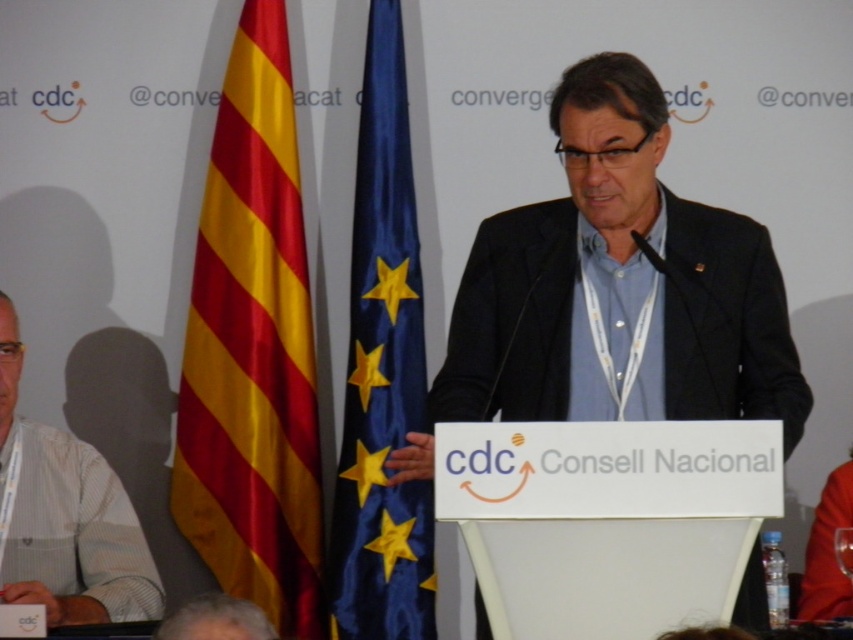
Question: Among these objects, which one is farthest from the camera?

Choices:
 (A) yellow/red striped fabric at left
 (B) blue satin flag at center

Answer: (A)

Question: Is black matte suit at center above yellow/red striped fabric at left?

Choices:
 (A) no
 (B) yes

Answer: (B)

Question: Which object is positioned farthest from the black matte suit at center?

Choices:
 (A) white striped shirt at lower left
 (B) yellow/red striped fabric at left

Answer: (B)

Question: Is the position of yellow/red striped fabric at left less distant than that of blue satin flag at center?

Choices:
 (A) no
 (B) yes

Answer: (A)

Question: Among these objects, which one is farthest from the camera?

Choices:
 (A) blue satin flag at center
 (B) white striped shirt at lower left

Answer: (A)

Question: Is the position of black matte suit at center less distant than that of yellow/red striped fabric at left?

Choices:
 (A) no
 (B) yes

Answer: (B)